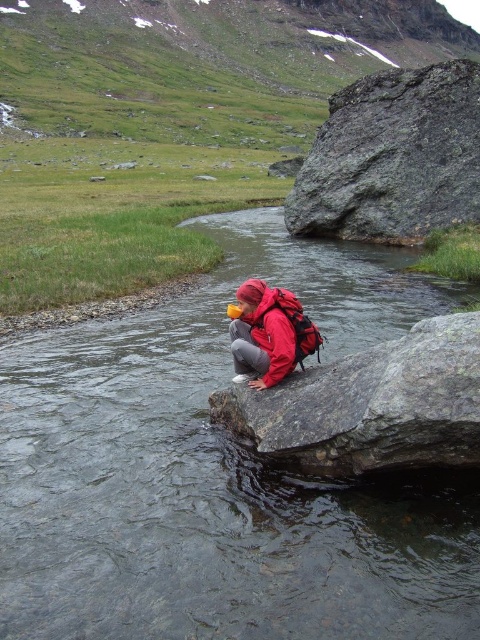
Question: Which point is farther from the camera taking this photo?

Choices:
 (A) (348, 221)
 (B) (245, 362)

Answer: (A)

Question: Can you confirm if smooth gray rock at center is thinner than red matte jacket at center?

Choices:
 (A) no
 (B) yes

Answer: (B)

Question: Which object appears farthest from the camera in this image?

Choices:
 (A) gray rough rock at upper right
 (B) red matte jacket at center
 (C) smooth gray rock at center
 (D) clear water stream at center

Answer: (A)

Question: Which of these objects is positioned closest to the gray rough rock at upper right?

Choices:
 (A) clear water stream at center
 (B) red matte jacket at center

Answer: (A)

Question: Is smooth gray rock at center to the left of red matte jacket at center from the viewer's perspective?

Choices:
 (A) yes
 (B) no

Answer: (B)

Question: Is smooth gray rock at center to the right of red matte jacket at center from the viewer's perspective?

Choices:
 (A) yes
 (B) no

Answer: (A)